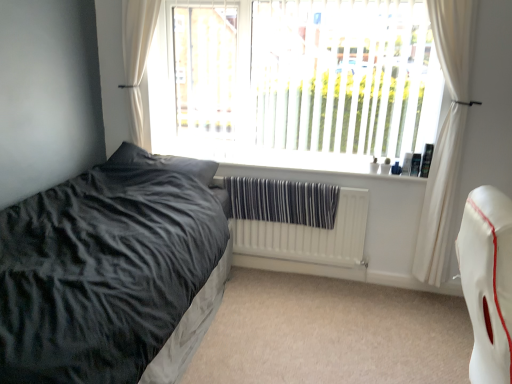
What is the approximate width of velvet black bed at left?

velvet black bed at left is 1.93 meters wide.

Measure the distance between point (115, 355) and camera.

The depth of point (115, 355) is 4.46 feet.

The image size is (512, 384). What do you see at coordinates (488, 282) in the screenshot?
I see `white leather swivel chair at right` at bounding box center [488, 282].

Find the location of a particular element. The height and width of the screenshot is (384, 512). white fabric curtain at upper left, the 1th curtain when ordered from left to right is located at coordinates (137, 61).

What do you see at coordinates (137, 61) in the screenshot? I see `white fabric curtain at upper left, the second curtain viewed from the right` at bounding box center [137, 61].

This screenshot has height=384, width=512. I want to click on white sheer curtain at right, which ranks as the second curtain in left-to-right order, so click(446, 135).

Image resolution: width=512 pixels, height=384 pixels. I want to click on white matte window sill at center, so point(289,163).

This screenshot has width=512, height=384. In order to click on white plastic window at upper center in this screenshot , I will do `click(341, 81)`.

Is white sheer curtain at right, which ranks as the first curtain in right-to-left order, oriented towards dark grey plush pillow at left?

No, white sheer curtain at right, which ranks as the first curtain in right-to-left order, does not turn towards dark grey plush pillow at left.

Considering the relative positions of white sheer curtain at right, which ranks as the second curtain in left-to-right order, and dark grey plush pillow at left in the image provided, is white sheer curtain at right, which ranks as the second curtain in left-to-right order, to the left or to the right of dark grey plush pillow at left?

Based on their positions, white sheer curtain at right, which ranks as the second curtain in left-to-right order, is located to the right of dark grey plush pillow at left.

How far apart are white sheer curtain at right, which ranks as the first curtain in right-to-left order, and dark grey plush pillow at left?

white sheer curtain at right, which ranks as the first curtain in right-to-left order, is 1.53 meters from dark grey plush pillow at left.

Based on the photo, is white sheer curtain at right, which ranks as the second curtain in left-to-right order, positioned far away from dark grey plush pillow at left?

Indeed, white sheer curtain at right, which ranks as the second curtain in left-to-right order, is not near dark grey plush pillow at left.

Looking at this image, can you confirm if white leather swivel chair at right is thinner than white matte window sill at center?

No, white leather swivel chair at right is not thinner than white matte window sill at center.

Is white leather swivel chair at right taller or shorter than white matte window sill at center?

white leather swivel chair at right is taller than white matte window sill at center.

Is white leather swivel chair at right looking in the opposite direction of white matte window sill at center?

No.

Is velvet black bed at left directly adjacent to white sheer curtain at right, which ranks as the first curtain in right-to-left order?

velvet black bed at left and white sheer curtain at right, which ranks as the first curtain in right-to-left order, are not in contact.

Is point (24, 232) closer or farther from the camera than point (433, 234)?

Clearly, point (24, 232) is closer to the camera than point (433, 234).

From a real-world perspective, does velvet black bed at left stand above white sheer curtain at right, which ranks as the first curtain in right-to-left order?

No, from a real-world perspective, velvet black bed at left is not over white sheer curtain at right, which ranks as the first curtain in right-to-left order

Is velvet black bed at left closer to the viewer compared to white sheer curtain at right, which ranks as the second curtain in left-to-right order?

That is True.

Based on their sizes in the image, would you say white leather swivel chair at right is bigger or smaller than velvet black bed at left?

Considering their sizes, white leather swivel chair at right takes up less space than velvet black bed at left.

Is white leather swivel chair at right located outside velvet black bed at left?

white leather swivel chair at right is positioned outside velvet black bed at left.

Does white leather swivel chair at right have a greater height compared to velvet black bed at left?

Indeed, white leather swivel chair at right has a greater height compared to velvet black bed at left.

Does white leather swivel chair at right have a greater width compared to velvet black bed at left?

In fact, white leather swivel chair at right might be narrower than velvet black bed at left.

Would you say white plastic window at upper center is inside or outside white leather swivel chair at right?

white plastic window at upper center exists outside the volume of white leather swivel chair at right.

Is white plastic window at upper center taller or shorter than white leather swivel chair at right?

Considering their sizes, white plastic window at upper center has more height than white leather swivel chair at right.

Measure the distance between white plastic window at upper center and white leather swivel chair at right.

white plastic window at upper center and white leather swivel chair at right are 5.44 feet apart.

Is white plastic window at upper center oriented towards white leather swivel chair at right?

Yes, white plastic window at upper center is facing white leather swivel chair at right.

From a real-world perspective, between white textured radiator at center and white matte window sill at center, who is vertically lower?

From a 3D spatial view, white textured radiator at center is below.

Considering the sizes of white textured radiator at center and white matte window sill at center in the image, is white textured radiator at center bigger or smaller than white matte window sill at center?

In the image, white textured radiator at center appears to be larger than white matte window sill at center.

Is point (268, 230) closer or farther from the camera than point (280, 160)?

Point (268, 230) is positioned closer to the camera compared to point (280, 160).

Is white textured radiator at center further to the viewer compared to white matte window sill at center?

Yes, white textured radiator at center is behind white matte window sill at center.

How distant is white fabric curtain at upper left, the second curtain viewed from the right, from dark grey plush pillow at left?

The distance of white fabric curtain at upper left, the second curtain viewed from the right, from dark grey plush pillow at left is 16.61 inches.

Which object is closer to the camera, white fabric curtain at upper left, the second curtain viewed from the right, or dark grey plush pillow at left?

dark grey plush pillow at left.

Who is taller, white fabric curtain at upper left, the second curtain viewed from the right, or dark grey plush pillow at left?

white fabric curtain at upper left, the second curtain viewed from the right, is taller.

From a real-world perspective, is white fabric curtain at upper left, the second curtain viewed from the right, on top of dark grey plush pillow at left?

Yes.

The image size is (512, 384). Find the location of `the 1st curtain above the dark grey plush pillow at left (from the image's perspective)`. the 1st curtain above the dark grey plush pillow at left (from the image's perspective) is located at coordinates (446, 135).

Locate an element on the screen. Image resolution: width=512 pixels, height=384 pixels. swivel chair that is below the white matte window sill at center (from the image's perspective) is located at coordinates (488, 282).

Which object lies nearer to the anchor point white sheer curtain at right, which ranks as the first curtain in right-to-left order, dark grey plush pillow at left or white leather swivel chair at right?

The object closer to white sheer curtain at right, which ranks as the first curtain in right-to-left order, is white leather swivel chair at right.

Estimate the real-world distances between objects in this image. Which object is further from dark grey plush pillow at left, velvet black bed at left or white matte window sill at center?

velvet black bed at left.

From the image, which object appears to be nearer to dark grey plush pillow at left, white textured radiator at center or white leather swivel chair at right?

white textured radiator at center is positioned closer to the anchor dark grey plush pillow at left.

Consider the image. Considering their positions, is white plastic window at upper center positioned closer to white leather swivel chair at right than white textured radiator at center?

white textured radiator at center is positioned closer to the anchor white leather swivel chair at right.

When comparing their distances from white plastic window at upper center, does white matte window sill at center or dark grey plush pillow at left seem closer?

The object closer to white plastic window at upper center is white matte window sill at center.

When comparing their distances from white fabric curtain at upper left, the 1th curtain when ordered from left to right, does white plastic window at upper center or velvet black bed at left seem further?

The object further to white fabric curtain at upper left, the 1th curtain when ordered from left to right, is velvet black bed at left.

Which object lies further to the anchor point white textured radiator at center, white matte window sill at center or white sheer curtain at right, which ranks as the second curtain in left-to-right order?

The object further to white textured radiator at center is white sheer curtain at right, which ranks as the second curtain in left-to-right order.

Which object lies further to the anchor point velvet black bed at left, white matte window sill at center or white textured radiator at center?

white textured radiator at center is positioned further to the anchor velvet black bed at left.

Locate an element on the screen. pillow between white leather swivel chair at right and white textured radiator at center from front to back is located at coordinates (164, 162).

Locate an element on the screen. This screenshot has width=512, height=384. curtain situated between velvet black bed at left and white sheer curtain at right, which ranks as the second curtain in left-to-right order, from left to right is located at coordinates (137, 61).

Identify the location of pillow between velvet black bed at left and white fabric curtain at upper left, the second curtain viewed from the right, in the front-back direction. (164, 162).

Find the location of a particular element. The image size is (512, 384). curtain positioned between white leather swivel chair at right and white fabric curtain at upper left, the 1th curtain when ordered from left to right, from near to far is located at coordinates (446, 135).